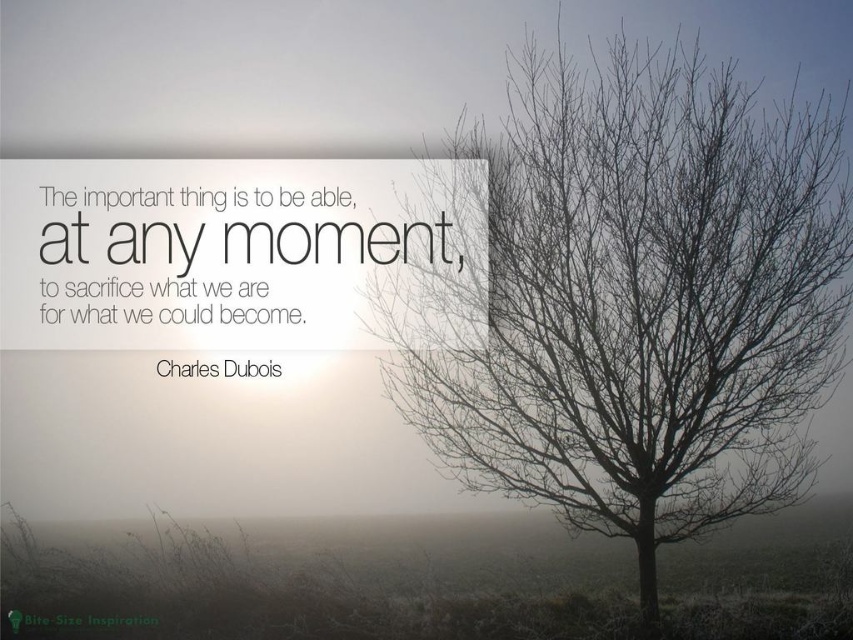
You are an artist analyzing the composition of the image. Which object takes up more visual space in the scene, the bare branches at right or the green matte text at lower left?

The green matte text at lower left occupies more visual space than the bare branches at right according to the description.

You are an artist sketching the landscape and need to decide which element to focus on first based on their sizes. Since you want to prioritize smaller elements, which object should you sketch first between the bare branches at right and the green matte text at lower left?

The bare branches at right should be sketched first because its width is smaller than the green matte text at lower left, making it the smaller element to prioritize.